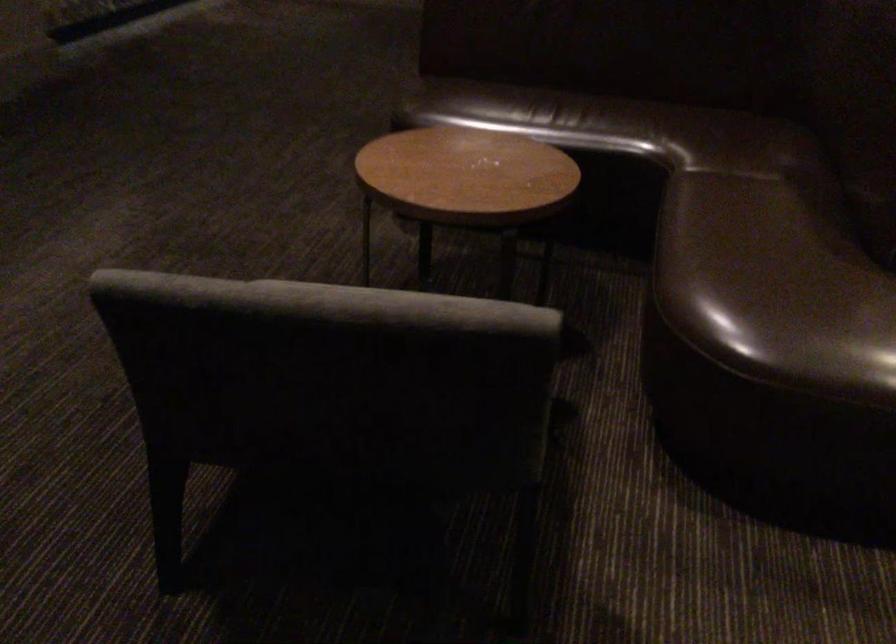
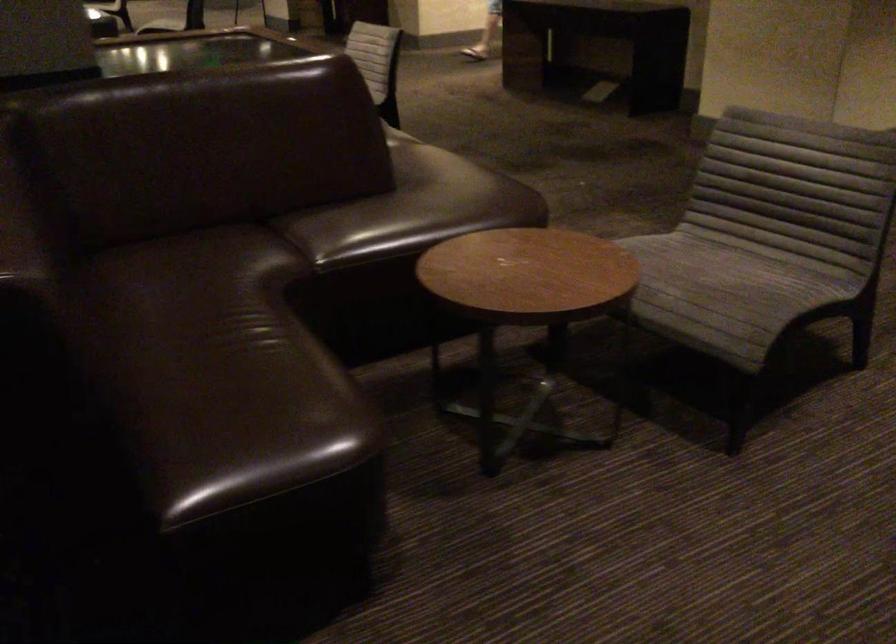
Find the pixel in the second image that matches the point at 497,82 in the first image.

(231, 399)